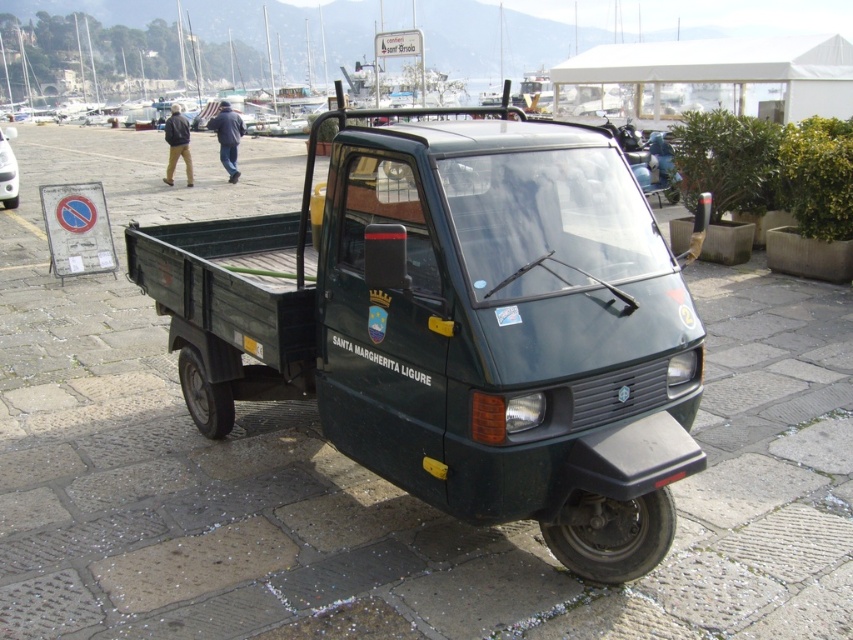
Question: Does green matte pickup truck at center appear over matte green truck at center?

Choices:
 (A) yes
 (B) no

Answer: (B)

Question: Which of the following is the farthest from the observer?

Choices:
 (A) (9, 173)
 (B) (664, 378)

Answer: (A)

Question: Does green matte pickup truck at center appear under matte green truck at center?

Choices:
 (A) yes
 (B) no

Answer: (A)

Question: Is the position of green matte pickup truck at center more distant than that of matte green truck at center?

Choices:
 (A) yes
 (B) no

Answer: (B)

Question: Which object appears closest to the camera in this image?

Choices:
 (A) matte green truck at center
 (B) green matte pickup truck at center

Answer: (B)